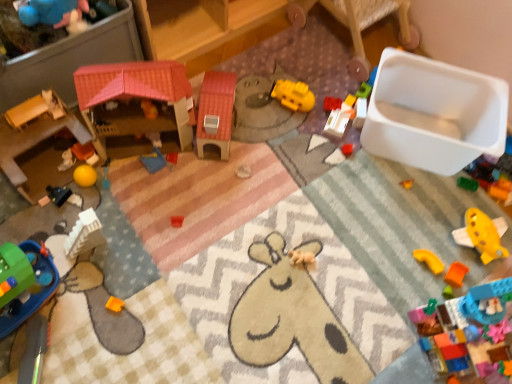
The width and height of the screenshot is (512, 384). Find the location of `free space that is in between yellow matte plastic toy at center, which is the 8th toy from left to right, and green plastic toy at lower left, the fourteenth toy viewed from the right`. free space that is in between yellow matte plastic toy at center, which is the 8th toy from left to right, and green plastic toy at lower left, the fourteenth toy viewed from the right is located at coordinates (192, 179).